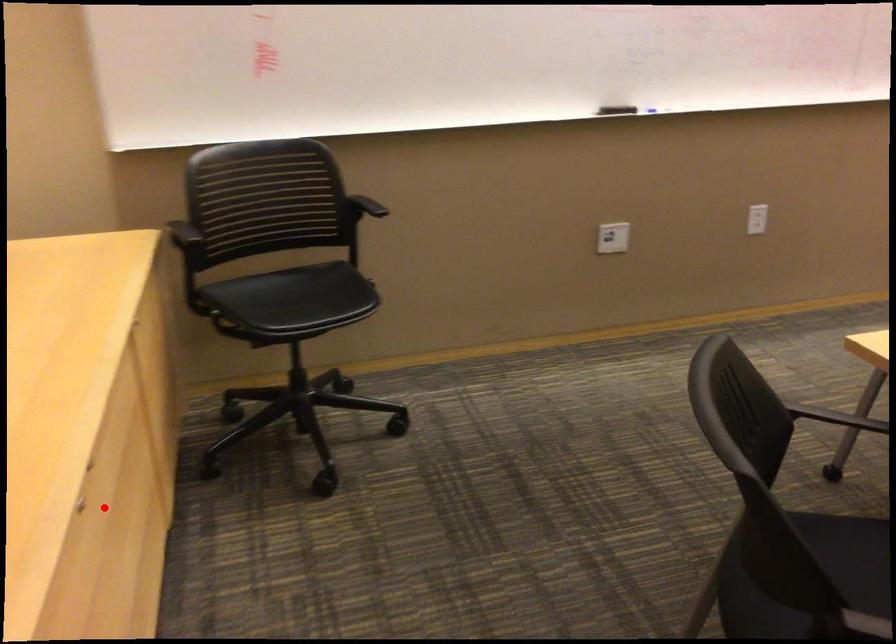
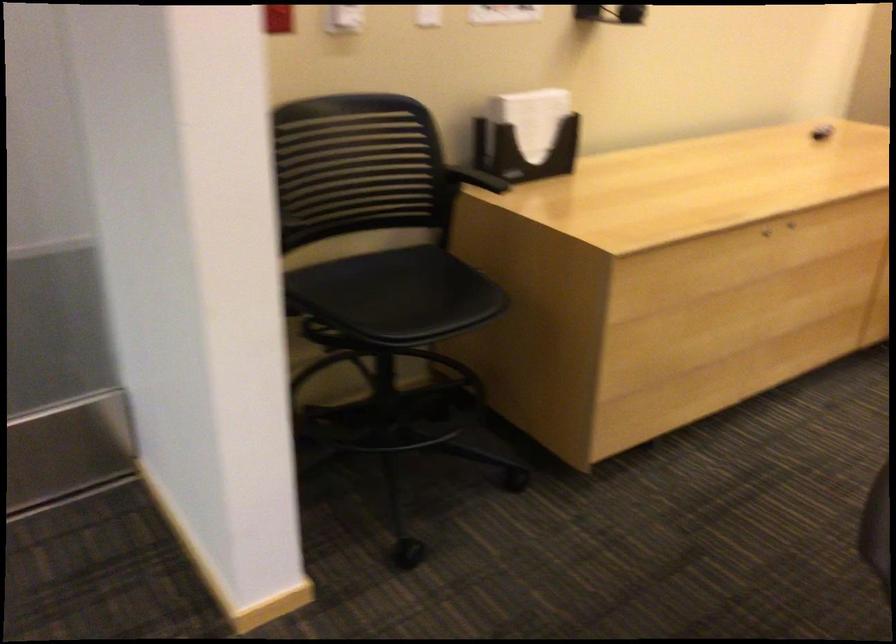
The point at the highlighted location is marked in the first image. Where is the corresponding point in the second image?

(790, 225)